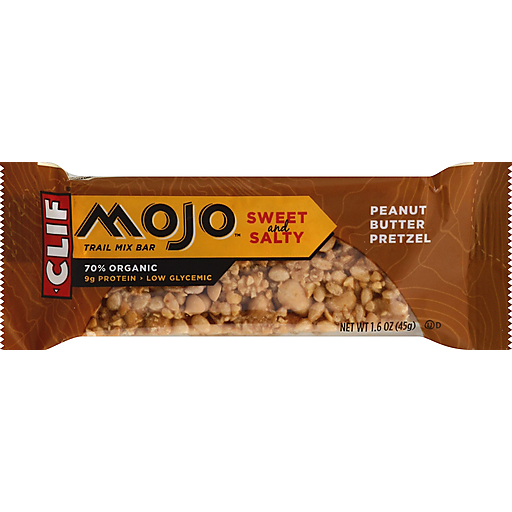
You are a GUI agent. You are given a task and a screenshot of the screen. Output one action in this format:
    pyautogui.click(x=<x>, y=<y>)
    Task: Click on the clear plastic window
    This screenshot has height=512, width=512.
    Given the screenshot: What is the action you would take?
    pyautogui.click(x=291, y=291)